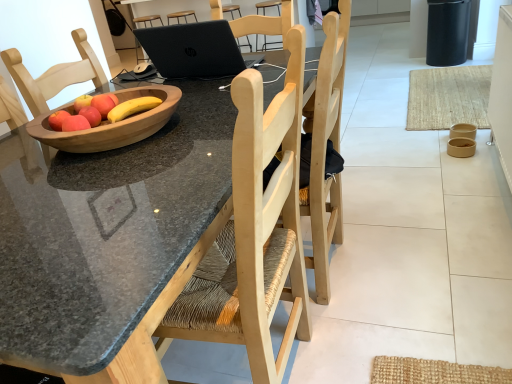
Question: In terms of height, does matte wooden apple at center, the 2th apple from the front, look taller or shorter compared to black matte laptop at upper center?

Choices:
 (A) tall
 (B) short

Answer: (B)

Question: From the image's perspective, is matte wooden apple at center, the 2th apple from the front, located above or below black matte laptop at upper center?

Choices:
 (A) above
 (B) below

Answer: (B)

Question: Based on their relative distances, which object is farther from the brown paper bowl at lower right, which ranks as the 2th bowl in back-to-front order?

Choices:
 (A) wooden bowl of fruit at center
 (B) black matte laptop at upper center
 (C) wooden bowl at left, which is the first bowl in left-to-right order
 (D) matte brown bowl at right, the 1th bowl viewed from the right
 (E) granite table at center

Answer: (E)

Question: Which object is the closest to the matte brown bowl at right, which is counted as the third bowl, starting from the left?

Choices:
 (A) wooden bowl at left, marked as the 1th bowl in a front-to-back arrangement
 (B) matte wood apple at center, which is the second apple in top-to-bottom order
 (C) granite table at center
 (D) black matte trash bin/can at upper right
 (E) matte wooden apple at center, the 1th apple in the top-to-bottom sequence

Answer: (D)